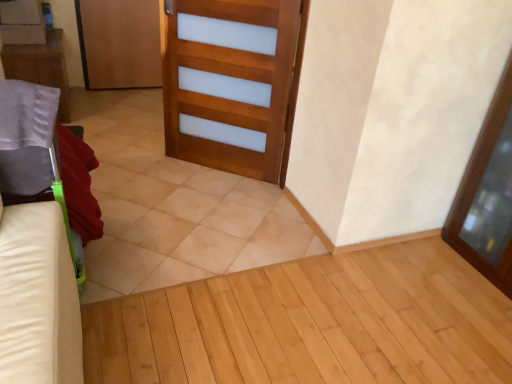
Question: Is there a large distance between wooden door at upper left, the first door from the left, and matte gray pillow at left?

Choices:
 (A) yes
 (B) no

Answer: (B)

Question: From the image's perspective, is wooden door at upper left, acting as the second door starting from the front, over matte gray pillow at left?

Choices:
 (A) yes
 (B) no

Answer: (A)

Question: Is wooden door at upper left, which is the second door from right to left, positioned in front of matte gray pillow at left?

Choices:
 (A) yes
 (B) no

Answer: (B)

Question: Can you confirm if wooden door at upper left, which is counted as the first door, starting from the back, is positioned to the right of matte gray pillow at left?

Choices:
 (A) yes
 (B) no

Answer: (A)

Question: From the image's perspective, is wooden door at upper left, acting as the second door starting from the front, located beneath matte gray pillow at left?

Choices:
 (A) yes
 (B) no

Answer: (B)

Question: Considering the relative sizes of wooden door at upper left, which ranks as the 2th door in bottom-to-top order, and matte gray pillow at left in the image provided, is wooden door at upper left, which ranks as the 2th door in bottom-to-top order, taller than matte gray pillow at left?

Choices:
 (A) yes
 (B) no

Answer: (A)

Question: Is matte gray pillow at left in contact with beige tile at center?

Choices:
 (A) no
 (B) yes

Answer: (A)

Question: Would you say matte gray pillow at left is outside beige tile at center?

Choices:
 (A) yes
 (B) no

Answer: (A)

Question: From the image's perspective, is matte gray pillow at left under beige tile at center?

Choices:
 (A) yes
 (B) no

Answer: (B)

Question: Considering the relative sizes of matte gray pillow at left and beige tile at center in the image provided, is matte gray pillow at left shorter than beige tile at center?

Choices:
 (A) no
 (B) yes

Answer: (A)

Question: Considering the relative sizes of matte gray pillow at left and beige tile at center in the image provided, is matte gray pillow at left bigger than beige tile at center?

Choices:
 (A) no
 (B) yes

Answer: (A)

Question: From the image's perspective, is matte gray pillow at left on top of beige tile at center?

Choices:
 (A) no
 (B) yes

Answer: (B)

Question: From the image's perspective, is beige tile at center over matte gray pillow at left?

Choices:
 (A) no
 (B) yes

Answer: (A)